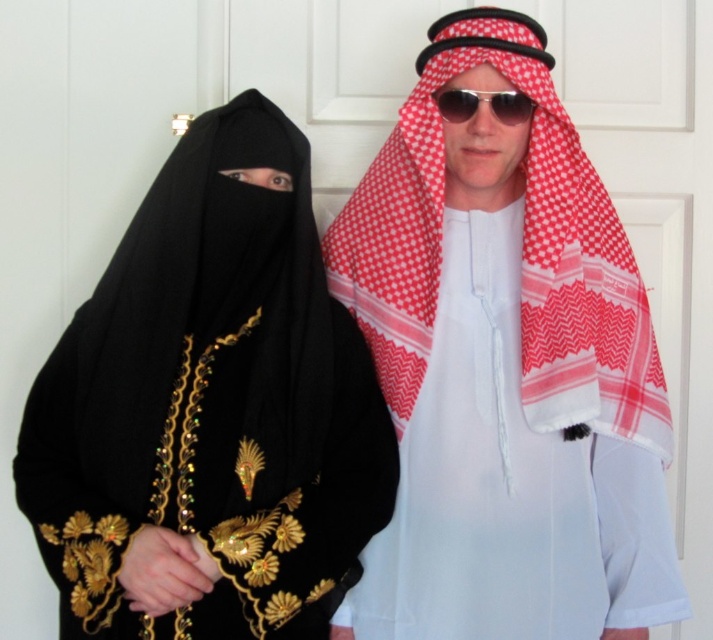
Question: Does black velvet abaya at left appear under red checkered scarf at upper right?

Choices:
 (A) no
 (B) yes

Answer: (B)

Question: Can you confirm if white woven keffiyeh at center is wider than sunglasses at center?

Choices:
 (A) yes
 (B) no

Answer: (A)

Question: Which of the following is the closest to the observer?

Choices:
 (A) (349, 429)
 (B) (441, 113)
 (C) (399, 355)

Answer: (A)

Question: Can you confirm if red checkered scarf at upper right is thinner than sunglasses at center?

Choices:
 (A) no
 (B) yes

Answer: (A)

Question: Which point is farther to the camera?

Choices:
 (A) (271, 163)
 (B) (602, 506)
 (C) (646, 403)

Answer: (B)

Question: Estimate the real-world distances between objects in this image. Which object is farther from the sunglasses at center?

Choices:
 (A) red checkered scarf at upper right
 (B) white woven keffiyeh at center

Answer: (B)